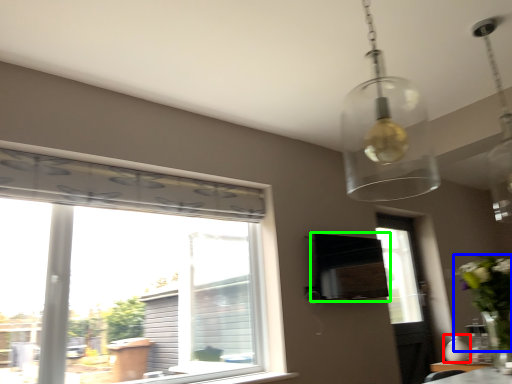
Question: Based on their relative distances, which object is nearer to vase (highlighted by a red box)? Choose from floral arrangement (highlighted by a blue box) and vent (highlighted by a green box).

Choices:
 (A) floral arrangement
 (B) vent

Answer: (A)